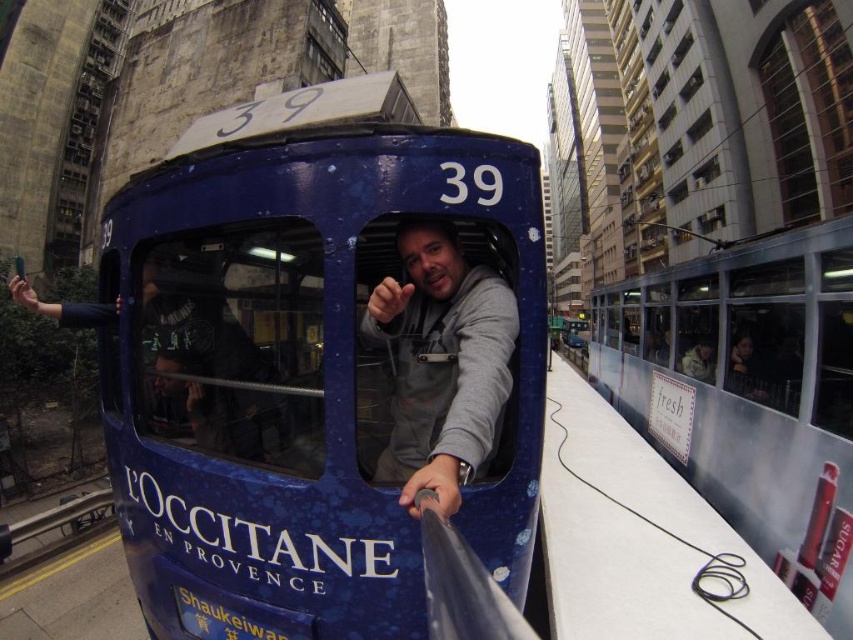
You are a pedestrian standing on the street and see the metallic silver tram at right and the gray fabric at center. Which object is closer to the ground?

The metallic silver tram at right is closer to the ground because it is below the gray fabric at center.

You are a city planner analyzing the street layout. Given the metallic silver tram at right and the gray fabric at center, which object occupies a larger horizontal space on the street?

The metallic silver tram at right is wider than the gray fabric at center, so it occupies a larger horizontal space on the street.

You are a delivery person standing at the gray fabric at center and need to deliver a package to the metallic silver tram at right. The package requires a clear path to be moved manually. Can you reach the tram without obstacles between you and the tram?

The metallic silver tram at right is 14.92 feet away from gray fabric at center. Since there are no obstacles mentioned between them in the scene description, you can reach the tram without any issues.